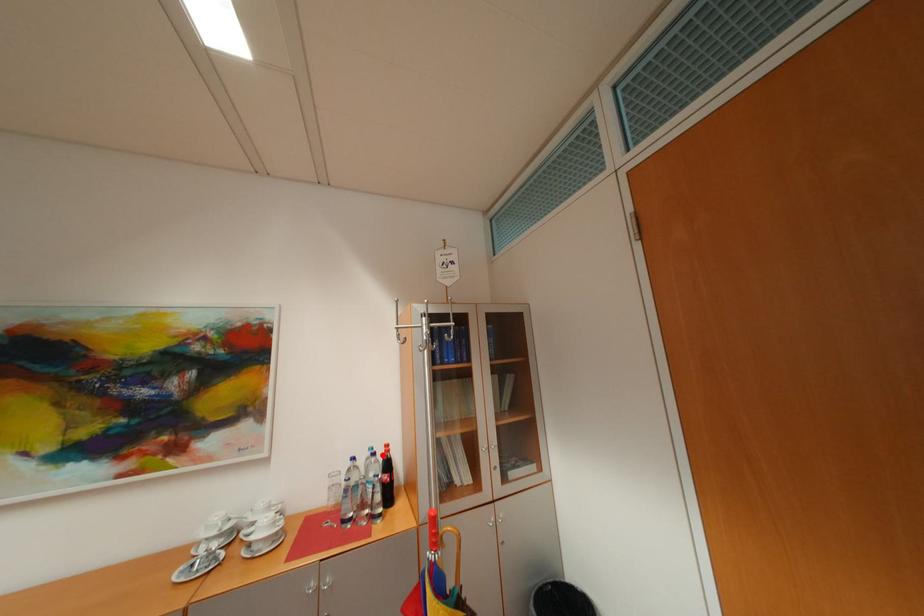
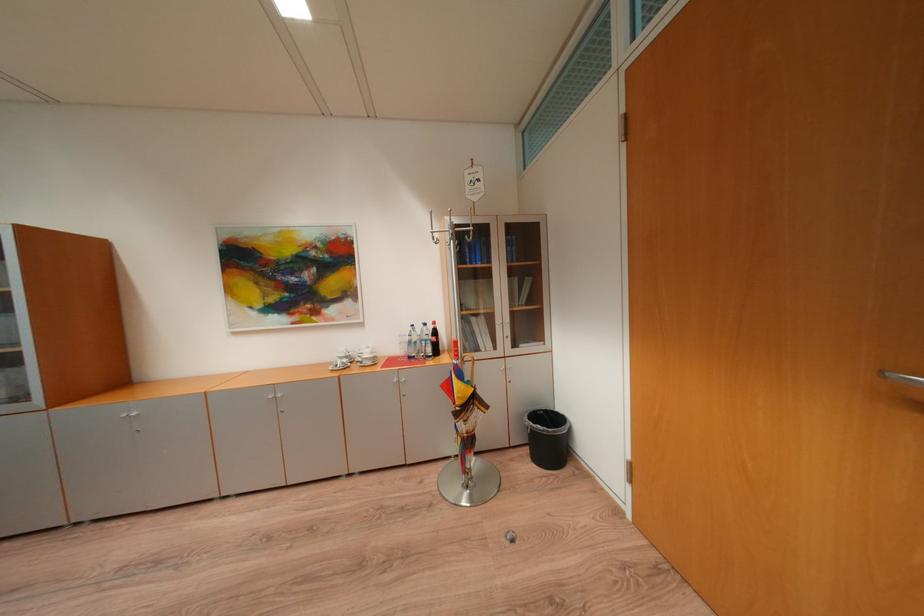
Locate, in the second image, the point that corresponds to the highlighted location in the first image.

(434, 326)